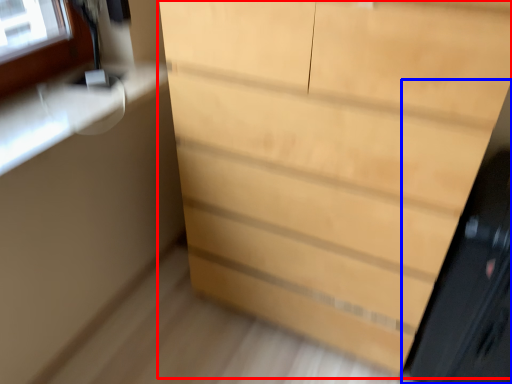
Question: Which object appears farthest to the camera in this image, chest of drawers (highlighted by a red box) or screen door (highlighted by a blue box)?

Choices:
 (A) chest of drawers
 (B) screen door

Answer: (B)